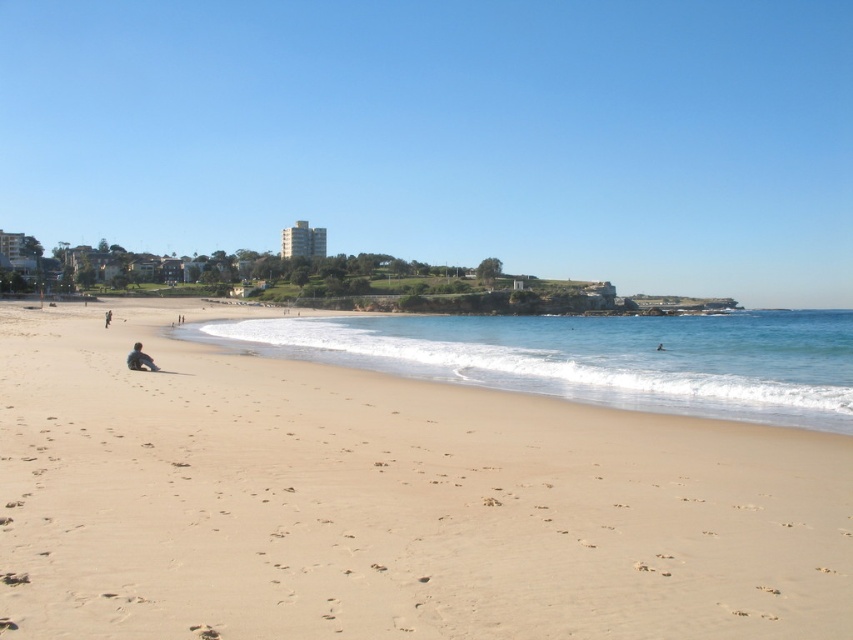
Is dark blue jeans at lower left to the right of smooth skin person at lower right from the viewer's perspective?

In fact, dark blue jeans at lower left is to the left of smooth skin person at lower right.

What do you see at coordinates (180, 317) in the screenshot? The width and height of the screenshot is (853, 640). I see `dark blue jeans at lower left` at bounding box center [180, 317].

Locate an element on the screen. The width and height of the screenshot is (853, 640). dark blue jeans at lower left is located at coordinates (180, 317).

Between light brown sand at lower left and smooth skin person at lower right, which one has more height?

light brown sand at lower left

Does light brown sand at lower left have a lesser width compared to smooth skin person at lower right?

Incorrect, light brown sand at lower left's width is not less than smooth skin person at lower right's.

Is point (107, 314) positioned behind point (663, 348)?

Yes, it is behind point (663, 348).

At what (x,y) coordinates should I click in order to perform the action: click on light brown sand at lower left. Please return your answer as a coordinate pair (x, y). Looking at the image, I should click on (107, 317).

From the picture: Is light brown sand at lower left taller than dark blue jeans at lower left?

Yes, light brown sand at lower left is taller than dark blue jeans at lower left.

Does point (109, 310) come closer to viewer compared to point (177, 323)?

No, it is behind (177, 323).

Which is behind, point (111, 310) or point (177, 316)?

The point (111, 310) is behind.

The width and height of the screenshot is (853, 640). In order to click on light brown sand at lower left in this screenshot , I will do `click(107, 317)`.